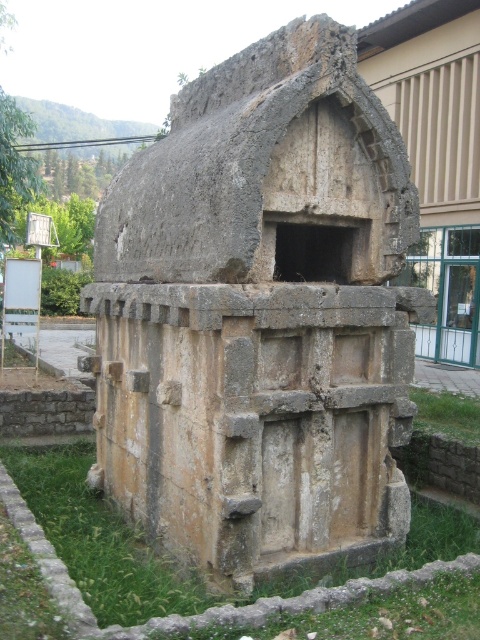
Question: Is weathered stone tomb at center wider than green grass at lower center?

Choices:
 (A) no
 (B) yes

Answer: (B)

Question: Can you confirm if weathered stone tomb at center is bigger than green grass at lower right?

Choices:
 (A) yes
 (B) no

Answer: (A)

Question: Which object is farther from the camera taking this photo?

Choices:
 (A) weathered stone tomb at center
 (B) green grass at lower center

Answer: (A)

Question: Which point is farther to the camera?

Choices:
 (A) green grass at lower right
 (B) rough stone tomb at center
 (C) green grass at lower center
 (D) weathered stone tomb at center

Answer: (A)

Question: Is weathered stone tomb at center below green grass at lower center?

Choices:
 (A) no
 (B) yes

Answer: (A)

Question: Which object is positioned closest to the green grass at lower right?

Choices:
 (A) weathered stone tomb at center
 (B) rough stone tomb at center

Answer: (A)